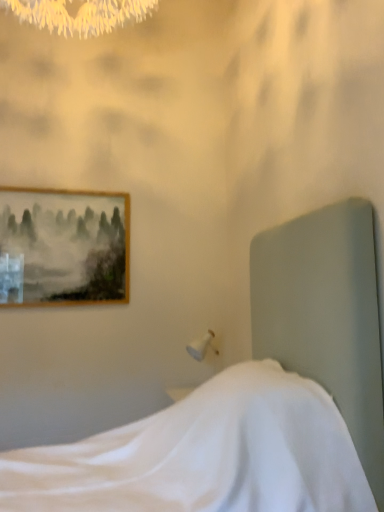
Question: From the image's perspective, would you say white fabric bed at center is positioned over wooden framed painting at upper left?

Choices:
 (A) no
 (B) yes

Answer: (A)

Question: Is wooden framed painting at upper left located within white fabric bed at center?

Choices:
 (A) yes
 (B) no

Answer: (B)

Question: Is white fabric bed at center positioned behind wooden framed painting at upper left?

Choices:
 (A) no
 (B) yes

Answer: (A)

Question: Is white fabric bed at center smaller than wooden framed painting at upper left?

Choices:
 (A) yes
 (B) no

Answer: (B)

Question: Could you tell me if white fabric bed at center is facing wooden framed painting at upper left?

Choices:
 (A) no
 (B) yes

Answer: (A)

Question: Can you confirm if white fabric bed at center is shorter than wooden framed painting at upper left?

Choices:
 (A) yes
 (B) no

Answer: (B)

Question: From a real-world perspective, is wooden framed painting at upper left located higher than white fabric bed at center?

Choices:
 (A) no
 (B) yes

Answer: (B)

Question: Does wooden framed painting at upper left turn towards white fabric bed at center?

Choices:
 (A) no
 (B) yes

Answer: (B)

Question: From the image's perspective, would you say wooden framed painting at upper left is shown under white fabric bed at center?

Choices:
 (A) no
 (B) yes

Answer: (A)

Question: Does wooden framed painting at upper left have a larger size compared to white fabric bed at center?

Choices:
 (A) no
 (B) yes

Answer: (A)

Question: Is white fabric bed at center a part of wooden framed painting at upper left?

Choices:
 (A) no
 (B) yes

Answer: (A)

Question: Does wooden framed painting at upper left lie behind white fabric bed at center?

Choices:
 (A) no
 (B) yes

Answer: (B)

Question: In terms of width, does wooden framed painting at upper left look wider or thinner when compared to white fabric bed at center?

Choices:
 (A) thin
 (B) wide

Answer: (A)